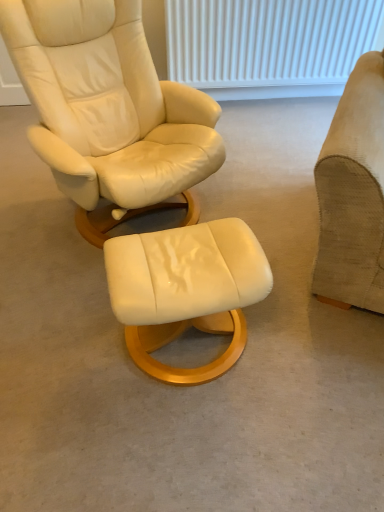
Question: Can you confirm if matte cream leather stool at center is smaller than suede beige armchair at right?

Choices:
 (A) no
 (B) yes

Answer: (B)

Question: Can we say matte cream leather stool at center lies outside suede beige armchair at right?

Choices:
 (A) no
 (B) yes

Answer: (B)

Question: From a real-world perspective, does matte cream leather stool at center sit lower than suede beige armchair at right?

Choices:
 (A) no
 (B) yes

Answer: (B)

Question: From the image's perspective, is matte cream leather stool at center beneath suede beige armchair at right?

Choices:
 (A) yes
 (B) no

Answer: (A)

Question: Does matte cream leather stool at center appear on the right side of suede beige armchair at right?

Choices:
 (A) yes
 (B) no

Answer: (B)

Question: Can you confirm if matte cream leather stool at center is bigger than suede beige armchair at right?

Choices:
 (A) no
 (B) yes

Answer: (A)

Question: Does matte cream leather stool at center lie behind white textured radiator at upper center?

Choices:
 (A) yes
 (B) no

Answer: (B)

Question: Is matte cream leather stool at center thinner than white textured radiator at upper center?

Choices:
 (A) yes
 (B) no

Answer: (B)

Question: Is matte cream leather stool at center turned away from white textured radiator at upper center?

Choices:
 (A) no
 (B) yes

Answer: (A)

Question: Is matte cream leather stool at center at the right side of white textured radiator at upper center?

Choices:
 (A) yes
 (B) no

Answer: (B)

Question: From a real-world perspective, does matte cream leather stool at center stand above white textured radiator at upper center?

Choices:
 (A) no
 (B) yes

Answer: (A)

Question: Is matte cream leather stool at center not inside white textured radiator at upper center?

Choices:
 (A) yes
 (B) no

Answer: (A)

Question: From the image's perspective, is white textured radiator at upper center above matte cream leather stool at center?

Choices:
 (A) yes
 (B) no

Answer: (A)